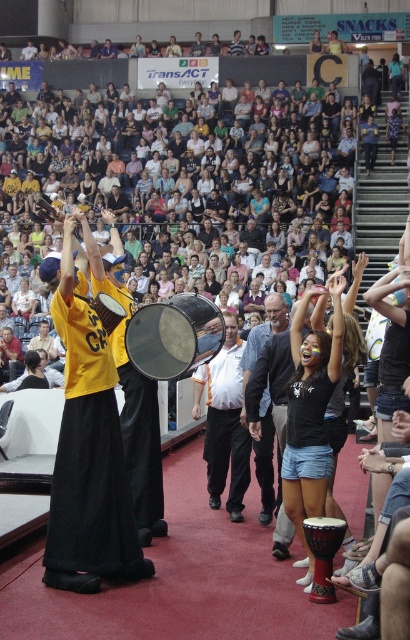
You are a photographer at the event and want to capture a photo of the shiny metallic drum at center and the gray fabric jacket at center. Which object should you focus on first if you want to include both in the same frame without moving the camera?

You should focus on the shiny metallic drum at center first because it is located above the gray fabric jacket at center, so adjusting the focus to the higher object ensures both are in the frame.

You are a performer in the arena and need to quickly grab your brown wooden drum at lower center from where you are standing next to the gray fabric jacket at center. Can you reach it without moving your feet?

The distance between the gray fabric jacket at center and the brown wooden drum at lower center is 5.04 feet. Since this distance is greater than an average person can reach without moving, you would need to move your feet to grab the drum.

You are a photographer at the event and want to capture both the shiny metallic drum at center and the brown wooden drum at lower center in a single frame. Which drum should you position closer to the left side of your camera viewfinder to ensure both are visible?

The shiny metallic drum at center is to the left of the brown wooden drum at lower center, so positioning the shiny metallic drum at center closer to the left side of the camera viewfinder will ensure both drums are captured in the frame.